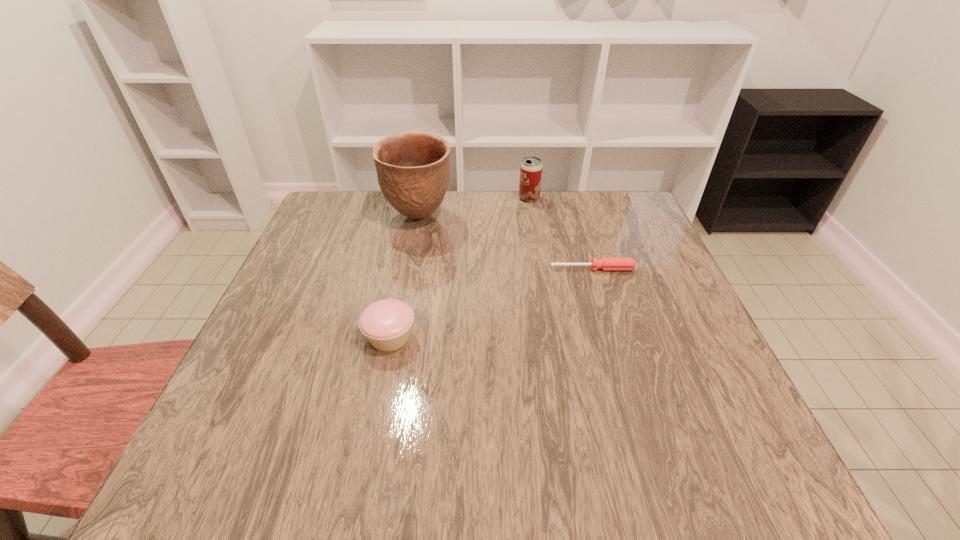
I want to click on pottery that is at the far edge, so click(413, 168).

Where is `beer can that is at the far edge`? The image size is (960, 540). beer can that is at the far edge is located at coordinates (531, 168).

At what (x,y) coordinates should I click in order to perform the action: click on object present at the right edge. Please return your answer as a coordinate pair (x, y). The image size is (960, 540). Looking at the image, I should click on (606, 264).

The height and width of the screenshot is (540, 960). I want to click on vacant area at the far edge, so click(x=384, y=203).

Where is `vacant region at the near edge of the desktop`? This screenshot has height=540, width=960. vacant region at the near edge of the desktop is located at coordinates (634, 452).

Image resolution: width=960 pixels, height=540 pixels. Identify the location of free space at the left edge. (336, 287).

This screenshot has height=540, width=960. In the image, there is a desktop. Identify the location of free space at the right edge. (651, 346).

The width and height of the screenshot is (960, 540). Identify the location of vacant area at the far left corner. (379, 199).

Locate an element on the screen. free space at the near right corner of the desktop is located at coordinates (676, 469).

Where is `free space between the nearest object and the beer can`? This screenshot has height=540, width=960. free space between the nearest object and the beer can is located at coordinates (460, 267).